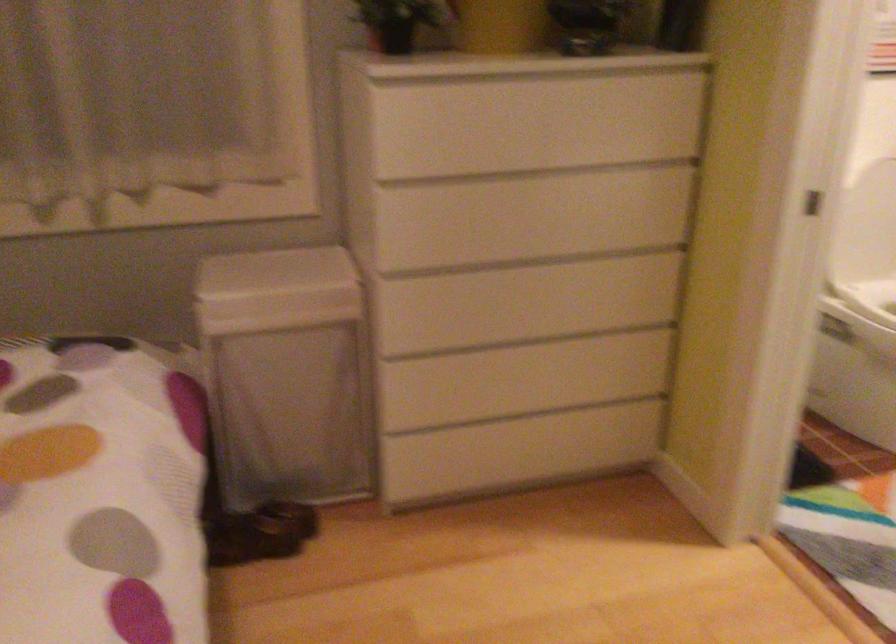
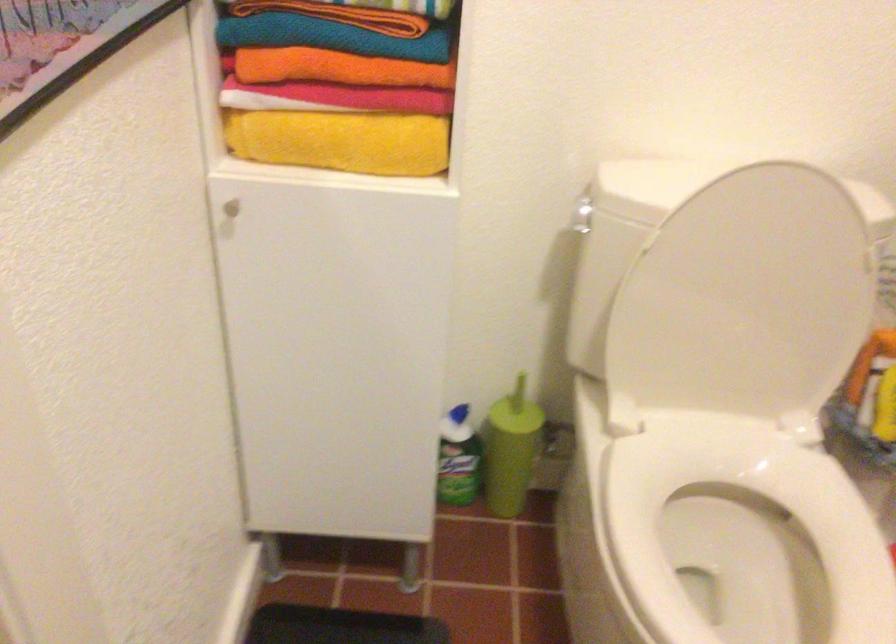
Locate, in the second image, the point that corresponds to point 711,136 in the first image.

(331, 37)